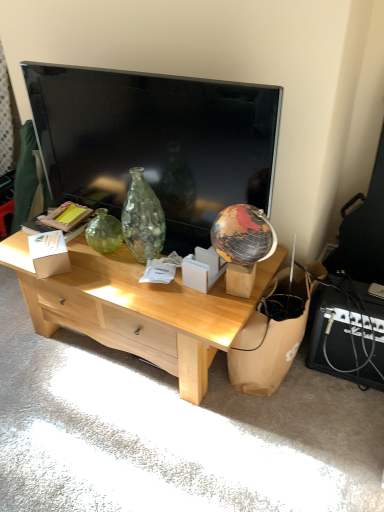
Where is `vacant point to the left of white cardboard box at center, which is the 2th cardboard box in left-to-right order`? This screenshot has width=384, height=512. vacant point to the left of white cardboard box at center, which is the 2th cardboard box in left-to-right order is located at coordinates (158, 288).